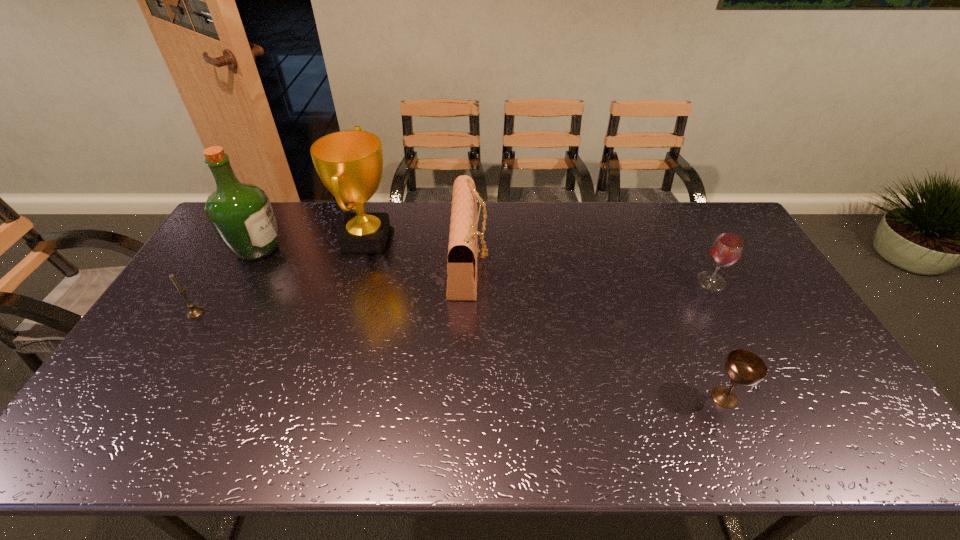
You are a GUI agent. You are given a task and a screenshot of the screen. Output one action in this format:
    pyautogui.click(x=<x>, y=<y>)
    Task: Click on the object that is positioned at the far left corner
    
    Given the screenshot: What is the action you would take?
    pyautogui.click(x=241, y=214)

The width and height of the screenshot is (960, 540). In the image, there is a desktop. What are the coordinates of `free region at the far edge` in the screenshot? It's located at (396, 222).

The height and width of the screenshot is (540, 960). In the image, there is a desktop. In order to click on free space at the near edge in this screenshot , I will do `click(363, 429)`.

Locate an element on the screen. The width and height of the screenshot is (960, 540). vacant position at the left edge of the desktop is located at coordinates (196, 276).

I want to click on vacant space at the far right corner of the desktop, so click(702, 202).

This screenshot has width=960, height=540. What are the coordinates of `free space between the chalice and the handbag` in the screenshot? It's located at (596, 329).

This screenshot has width=960, height=540. I want to click on free space between the fourth object from left to right and the fifth farthest object, so click(x=332, y=287).

Where is `vacant space in between the third object from right to left and the wineglass`? Image resolution: width=960 pixels, height=540 pixels. vacant space in between the third object from right to left and the wineglass is located at coordinates (589, 272).

Image resolution: width=960 pixels, height=540 pixels. In order to click on free spot between the wineglass and the third object from right to left in this screenshot , I will do `click(589, 272)`.

Find the location of a particular element. vacant space in between the fourth object from left to right and the chalice is located at coordinates coord(596,329).